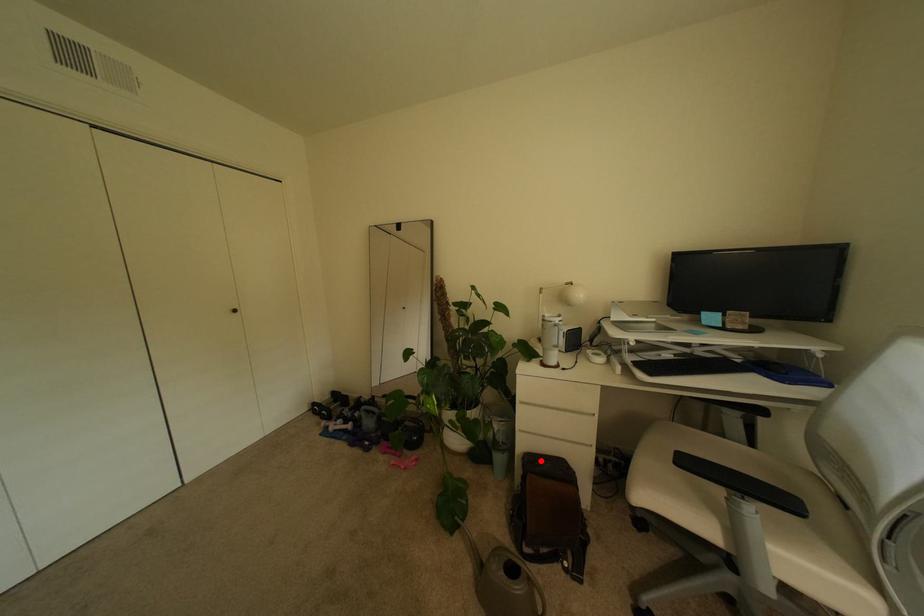
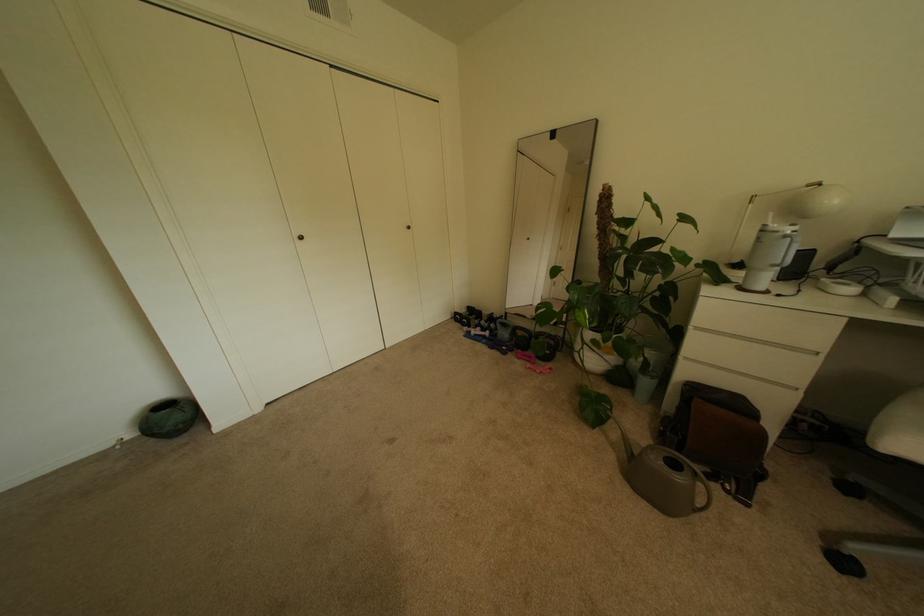
Locate, in the second image, the point that corresponds to the highlighted location in the first image.

(704, 391)